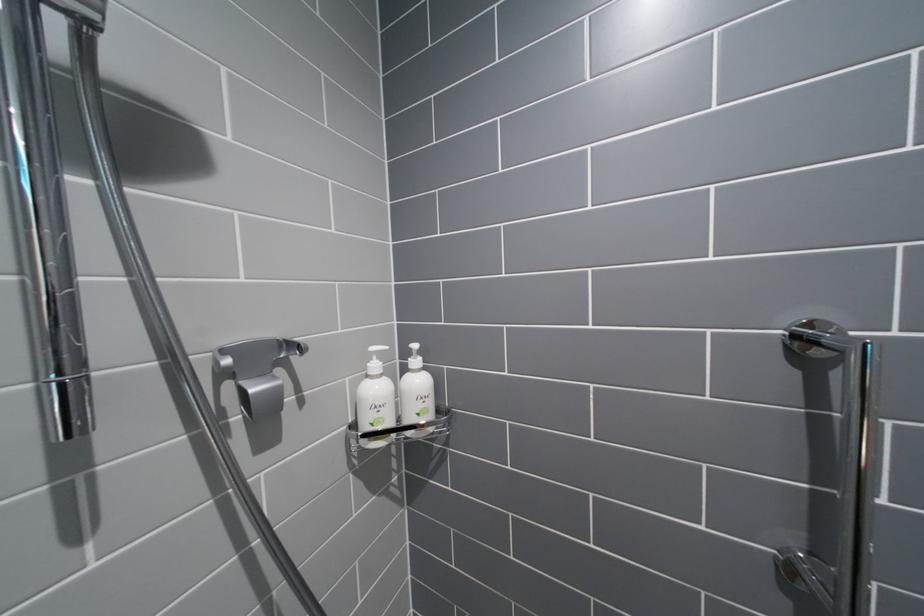
Find where to grip the chrome grab bar. Please return your answer as a coordinate pair (x, y).

(868, 496)